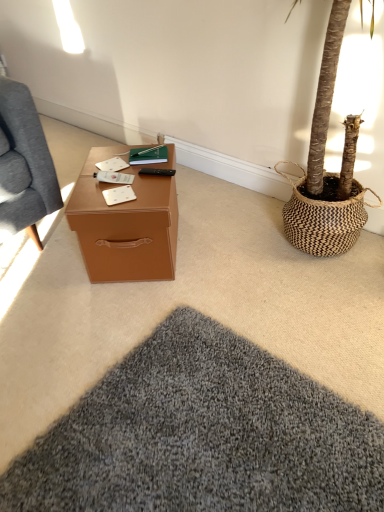
Where is `hardcover book at center`? Image resolution: width=384 pixels, height=512 pixels. hardcover book at center is located at coordinates (148, 155).

Where is `soft gray carpet at center`? Image resolution: width=384 pixels, height=512 pixels. soft gray carpet at center is located at coordinates (202, 435).

What is the approximate width of soft gray carpet at center?

The width of soft gray carpet at center is 8.55 feet.

The width and height of the screenshot is (384, 512). Identify the location of white matte notepad at center. (119, 195).

Is hardcover book at center in front of or behind black matte remote control at center in the image?

Clearly, hardcover book at center is behind black matte remote control at center.

Does hardcover book at center have a smaller size compared to black matte remote control at center?

No.

Which of these two, hardcover book at center or black matte remote control at center, is thinner?

black matte remote control at center.

From the image's perspective, is hardcover book at center located above or below black matte remote control at center?

hardcover book at center is situated higher than black matte remote control at center in the image.

From the picture: What's the angular difference between white matte notepad at center and hardcover book at center's facing directions?

The angular difference between white matte notepad at center and hardcover book at center is 22.4 degrees.

From the image's perspective, is white matte notepad at center on hardcover book at center?

No.

At what (x,y) coordinates should I click in order to perform the action: click on notepad lying below the hardcover book at center (from the image's perspective). Please return your answer as a coordinate pair (x, y). Looking at the image, I should click on (119, 195).

Is white matte notepad at center aimed at hardcover book at center?

No, white matte notepad at center is not oriented towards hardcover book at center.

Considering the sizes of objects black matte remote control at center and white matte notepad at center in the image provided, who is shorter, black matte remote control at center or white matte notepad at center?

Standing shorter between the two is white matte notepad at center.

How distant is black matte remote control at center from white matte notepad at center?

black matte remote control at center is 6.42 inches from white matte notepad at center.

From a real-world perspective, is black matte remote control at center on top of white matte notepad at center?

Yes, from a real-world perspective, black matte remote control at center is over white matte notepad at center

What's the angular difference between black matte remote control at center and white matte notepad at center's facing directions?

The angular difference between black matte remote control at center and white matte notepad at center is 36.6 degrees.

Is point (120, 196) positioned before point (98, 385)?

That is False.

From the image's perspective, which one is positioned lower, white matte notepad at center or soft gray carpet at center?

soft gray carpet at center is shown below in the image.

Can you confirm if white matte notepad at center is shorter than soft gray carpet at center?

Correct, white matte notepad at center is not as tall as soft gray carpet at center.

From a real-world perspective, is white matte notepad at center located beneath soft gray carpet at center?

Incorrect, from a real-world perspective, white matte notepad at center is higher than soft gray carpet at center.

From the picture: Can you tell me how much brown leather desk at center and white matte notepad at center differ in facing direction?

23.8 degrees.

From the image's perspective, is brown leather desk at center above or below white matte notepad at center?

Clearly, from the image's perspective, brown leather desk at center is below white matte notepad at center.

Is brown leather desk at center thinner than white matte notepad at center?

No, brown leather desk at center is not thinner than white matte notepad at center.

Does point (77, 222) come farther from viewer compared to point (114, 196)?

No, it is in front of (114, 196).

Is black matte remote control at center turned away from brown leather desk at center?

No, black matte remote control at center is not facing the opposite direction of brown leather desk at center.

Does black matte remote control at center contain brown leather desk at center?

No, brown leather desk at center is located outside of black matte remote control at center.

From the image's perspective, which one is positioned lower, black matte remote control at center or brown leather desk at center?

brown leather desk at center, from the image's perspective.

In the scene shown: Are black matte remote control at center and brown leather desk at center making contact?

No, black matte remote control at center is not making contact with brown leather desk at center.

From their relative heights in the image, would you say white matte notepad at center is taller or shorter than black matte remote control at center?

Clearly, white matte notepad at center is shorter compared to black matte remote control at center.

Is white matte notepad at center with black matte remote control at center?

No.

Who is bigger, white matte notepad at center or black matte remote control at center?

black matte remote control at center is bigger.

Image resolution: width=384 pixels, height=512 pixels. Identify the location of remote control that is on the right side of white matte notepad at center. (157, 172).

Where is `remote control above the hardcover book at center (from a real-world perspective)`? remote control above the hardcover book at center (from a real-world perspective) is located at coordinates (157, 172).

Where is `notepad below the hardcover book at center (from the image's perspective)`? notepad below the hardcover book at center (from the image's perspective) is located at coordinates (119, 195).

Estimate the real-world distances between objects in this image. Which object is further from brown leather desk at center, soft gray carpet at center or hardcover book at center?

soft gray carpet at center is positioned further to the anchor brown leather desk at center.

Which object lies nearer to the anchor point brown leather desk at center, black matte remote control at center or soft gray carpet at center?

The object closer to brown leather desk at center is black matte remote control at center.

Looking at the image, which one is located closer to hardcover book at center, soft gray carpet at center or white matte notepad at center?

The object closer to hardcover book at center is white matte notepad at center.

Estimate the real-world distances between objects in this image. Which object is closer to brown leather desk at center, hardcover book at center or soft gray carpet at center?

Based on the image, hardcover book at center appears to be nearer to brown leather desk at center.

Based on their spatial positions, is white matte notepad at center or soft gray carpet at center further from brown leather desk at center?

The object further to brown leather desk at center is soft gray carpet at center.

When comparing their distances from hardcover book at center, does black matte remote control at center or brown leather desk at center seem further?

brown leather desk at center.

In the scene shown: Estimate the real-world distances between objects in this image. Which object is further from hardcover book at center, soft gray carpet at center or black matte remote control at center?

Among the two, soft gray carpet at center is located further to hardcover book at center.

When comparing their distances from black matte remote control at center, does soft gray carpet at center or brown leather desk at center seem further?

The object further to black matte remote control at center is soft gray carpet at center.

I want to click on desk between soft gray carpet at center and black matte remote control at center in the front-back direction, so click(x=125, y=226).

Where is `remote control located between white matte notepad at center and hardcover book at center in the depth direction`? This screenshot has height=512, width=384. remote control located between white matte notepad at center and hardcover book at center in the depth direction is located at coordinates (157, 172).

You are a GUI agent. You are given a task and a screenshot of the screen. Output one action in this format:
    pyautogui.click(x=<x>, y=<y>)
    Task: Click on the notepad between soft gray carpet at center and hardcover book at center along the z-axis
    
    Given the screenshot: What is the action you would take?
    pyautogui.click(x=119, y=195)

Identify the location of notepad positioned between brown leather desk at center and black matte remote control at center from near to far. Image resolution: width=384 pixels, height=512 pixels. (119, 195).